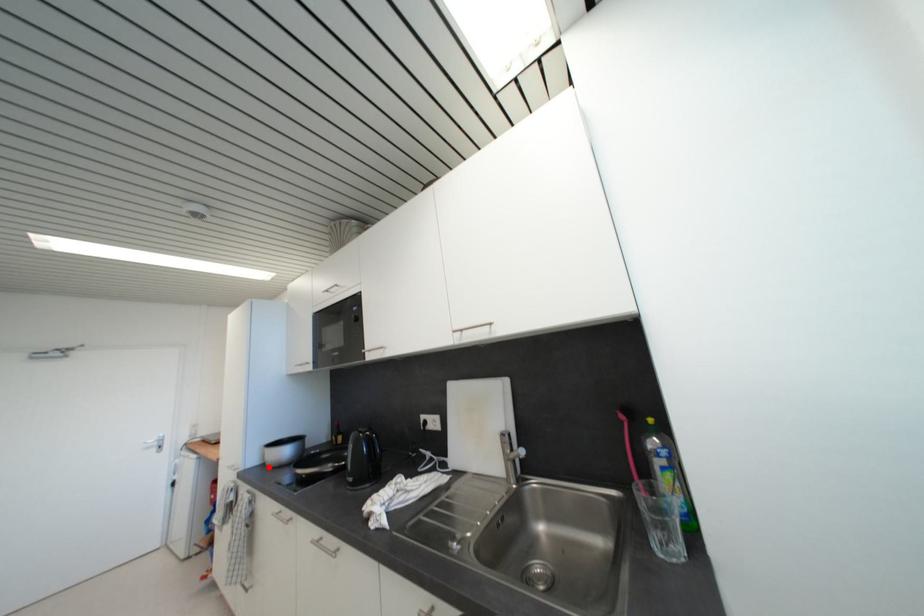
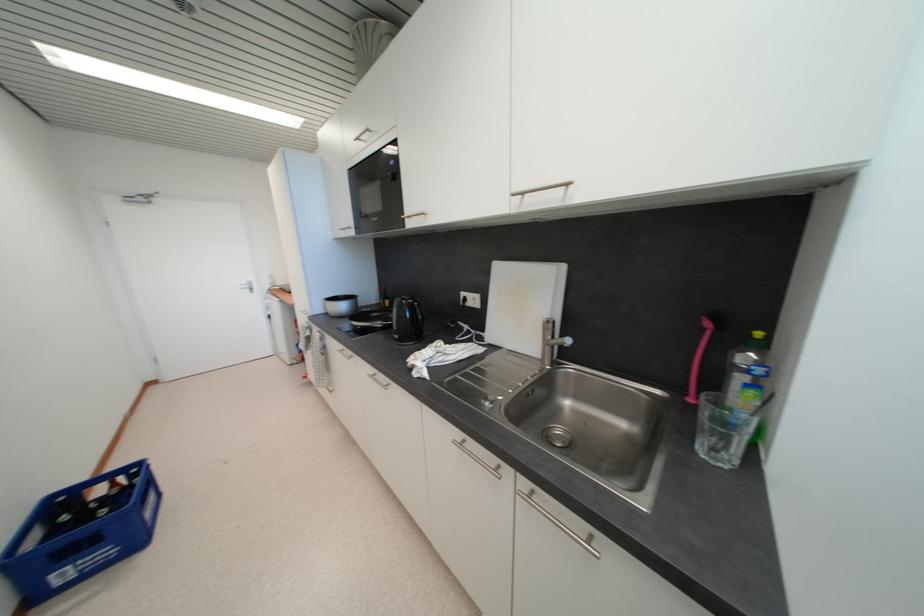
In the second image, find the point that corresponds to the highlighted location in the first image.

(332, 315)